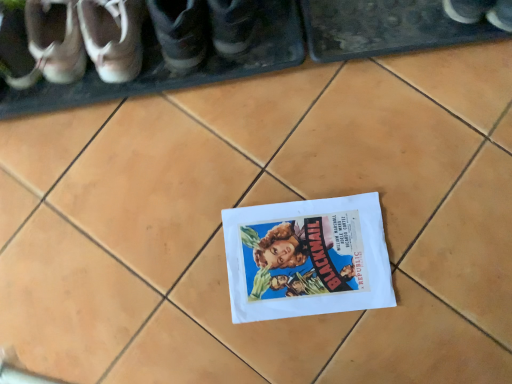
Describe the element at coordinates (307, 258) in the screenshot. The image size is (512, 384). I see `white paper flyer at center` at that location.

Measure the distance between point (108, 57) and camera.

Point (108, 57) and camera are 76.10 centimeters apart from each other.

Locate an element on the screen. The width and height of the screenshot is (512, 384). matte brown shoe at upper left, the fourth footwear from the right is located at coordinates pos(113,37).

What do you see at coordinates (15, 49) in the screenshot? I see `white leather shoe at left, marked as the sixth footwear in a right-to-left arrangement` at bounding box center [15, 49].

I want to click on dark gray leather shoe at upper left, the 5th footwear from the left, so click(180, 32).

This screenshot has width=512, height=384. What are the coordinates of `matte white sneakers at upper left, arranged as the 3th footwear when viewed from the right` in the screenshot? It's located at (230, 54).

Where is `matte leather shoes at upper left, the fifth footwear positioned from the right`? The image size is (512, 384). matte leather shoes at upper left, the fifth footwear positioned from the right is located at coordinates (55, 39).

In order to click on white paper flyer at center in this screenshot , I will do `click(307, 258)`.

Considering the relative sizes of matte black shoe at center, the 1th footwear from the right, and white leather shoe at left, marked as the sixth footwear in a right-to-left arrangement, in the image provided, is matte black shoe at center, the 1th footwear from the right, smaller than white leather shoe at left, marked as the sixth footwear in a right-to-left arrangement,?

Incorrect, matte black shoe at center, the 1th footwear from the right, is not smaller in size than white leather shoe at left, marked as the sixth footwear in a right-to-left arrangement.

Is matte black shoe at center, which is the sixth footwear in left-to-right order, to the right of white leather shoe at left, which ranks as the first footwear in left-to-right order, from the viewer's perspective?

Yes.

From a real-world perspective, between matte black shoe at center, which is the sixth footwear in left-to-right order, and white leather shoe at left, which ranks as the first footwear in left-to-right order, who is vertically lower?

white leather shoe at left, which ranks as the first footwear in left-to-right order, is physically lower.

Is white leather shoe at left, marked as the sixth footwear in a right-to-left arrangement, at the back of matte black shoe at center, which is the sixth footwear in left-to-right order?

No, white leather shoe at left, marked as the sixth footwear in a right-to-left arrangement, is not at the back of matte black shoe at center, which is the sixth footwear in left-to-right order.

Are matte white sneakers at upper left, arranged as the 3th footwear when viewed from the right, and white paper flyer at center beside each other?

matte white sneakers at upper left, arranged as the 3th footwear when viewed from the right, and white paper flyer at center are clearly separated.

From the image's perspective, which is above, matte white sneakers at upper left, which is the fourth footwear from left to right, or white paper flyer at center?

matte white sneakers at upper left, which is the fourth footwear from left to right, is shown above in the image.

Which is closer, (3, 40) or (264, 224)?

The point (3, 40) is closer.

Considering the sizes of objects matte white sneakers at upper left, which is the fourth footwear from left to right, and white paper flyer at center in the image provided, who is shorter, matte white sneakers at upper left, which is the fourth footwear from left to right, or white paper flyer at center?

With less height is white paper flyer at center.

Would you say dark gray leather shoe at upper left, the 2th footwear from the right, is outside matte leather shoes at upper left, the fifth footwear positioned from the right?

Yes, dark gray leather shoe at upper left, the 2th footwear from the right, is not within matte leather shoes at upper left, the fifth footwear positioned from the right.

How far apart are dark gray leather shoe at upper left, the 2th footwear from the right, and matte leather shoes at upper left, which ranks as the 2th footwear in left-to-right order?

The distance of dark gray leather shoe at upper left, the 2th footwear from the right, from matte leather shoes at upper left, which ranks as the 2th footwear in left-to-right order, is 19.42 centimeters.

Which is in front, point (182, 55) or point (48, 41)?

Positioned in front is point (182, 55).

Locate an element on the screen. This screenshot has height=384, width=512. the 1st footwear positioned below the dark gray leather shoe at upper left, the 5th footwear from the left (from the image's perspective) is located at coordinates (55, 39).

Who is more distant, white paper flyer at center or dark gray leather shoe at upper left, the 2th footwear from the right?

white paper flyer at center is further from the camera.

Is white paper flyer at center placed right next to dark gray leather shoe at upper left, the 5th footwear from the left?

white paper flyer at center is not next to dark gray leather shoe at upper left, the 5th footwear from the left, and they're not touching.

How much distance is there between white paper flyer at center and dark gray leather shoe at upper left, the 5th footwear from the left?

white paper flyer at center and dark gray leather shoe at upper left, the 5th footwear from the left, are 15.97 inches apart from each other.

Consider the image. From a real-world perspective, who is located lower, white leather shoe at left, which ranks as the first footwear in left-to-right order, or matte leather shoes at upper left, the fifth footwear positioned from the right?

matte leather shoes at upper left, the fifth footwear positioned from the right, from a real-world perspective.

Can you confirm if white leather shoe at left, marked as the sixth footwear in a right-to-left arrangement, is shorter than matte leather shoes at upper left, which ranks as the 2th footwear in left-to-right order?

No.

Do you think white leather shoe at left, which ranks as the first footwear in left-to-right order, is within matte leather shoes at upper left, which ranks as the 2th footwear in left-to-right order, or outside of it?

The correct answer is: outside.

From the image's perspective, does white leather shoe at left, which ranks as the first footwear in left-to-right order, appear lower than matte leather shoes at upper left, which ranks as the 2th footwear in left-to-right order?

Correct, white leather shoe at left, which ranks as the first footwear in left-to-right order, appears lower than matte leather shoes at upper left, which ranks as the 2th footwear in left-to-right order, in the image.

In the scene shown: Considering the relative positions of matte leather shoes at upper left, the fifth footwear positioned from the right, and matte white sneakers at upper left, which is the fourth footwear from left to right, in the image provided, is matte leather shoes at upper left, the fifth footwear positioned from the right, behind matte white sneakers at upper left, which is the fourth footwear from left to right,?

No, the depth of matte leather shoes at upper left, the fifth footwear positioned from the right, is less than that of matte white sneakers at upper left, which is the fourth footwear from left to right.

There is a matte leather shoes at upper left, the fifth footwear positioned from the right. Where is `the 2nd footwear below it (from a real-world perspective)`? The width and height of the screenshot is (512, 384). the 2nd footwear below it (from a real-world perspective) is located at coordinates (230, 54).

Is matte leather shoes at upper left, the fifth footwear positioned from the right, at the right side of matte white sneakers at upper left, arranged as the 3th footwear when viewed from the right?

Incorrect, matte leather shoes at upper left, the fifth footwear positioned from the right, is not on the right side of matte white sneakers at upper left, arranged as the 3th footwear when viewed from the right.

Does matte brown shoe at upper left, the fourth footwear from the right, have a larger size compared to matte black shoe at center, the 1th footwear from the right?

No, matte brown shoe at upper left, the fourth footwear from the right, is not bigger than matte black shoe at center, the 1th footwear from the right.

From a real-world perspective, is matte brown shoe at upper left, marked as the third footwear in a left-to-right arrangement, physically located above or below matte black shoe at center, the 1th footwear from the right?

From a real-world perspective, matte brown shoe at upper left, marked as the third footwear in a left-to-right arrangement, is physically below matte black shoe at center, the 1th footwear from the right.

Could matte black shoe at center, the 1th footwear from the right, be considered to be inside matte brown shoe at upper left, marked as the third footwear in a left-to-right arrangement?

No, matte black shoe at center, the 1th footwear from the right, is not surrounded by matte brown shoe at upper left, marked as the third footwear in a left-to-right arrangement.

Where is `footwear that is the 3rd one when counting upward from the matte brown shoe at upper left, the fourth footwear from the right (from the image's perspective)`? footwear that is the 3rd one when counting upward from the matte brown shoe at upper left, the fourth footwear from the right (from the image's perspective) is located at coordinates (232, 24).

Starting from the matte black shoe at center, the 1th footwear from the right, which footwear is the 2nd one behind? Please provide its 2D coordinates.

[(15, 49)]

From the image's perspective, which footwear is the 1st one above the white paper flyer at center? Please provide its 2D coordinates.

[(230, 54)]

Considering their positions, is white paper flyer at center positioned closer to matte leather shoes at upper left, which ranks as the 2th footwear in left-to-right order, than matte white sneakers at upper left, which is the fourth footwear from left to right?

matte white sneakers at upper left, which is the fourth footwear from left to right, is positioned closer to the anchor matte leather shoes at upper left, which ranks as the 2th footwear in left-to-right order.

When comparing their distances from white paper flyer at center, does matte black shoe at center, which is the sixth footwear in left-to-right order, or dark gray leather shoe at upper left, the 5th footwear from the left, seem further?

matte black shoe at center, which is the sixth footwear in left-to-right order.

When comparing their distances from matte leather shoes at upper left, the fifth footwear positioned from the right, does matte black shoe at center, which is the sixth footwear in left-to-right order, or white paper flyer at center seem closer?

matte black shoe at center, which is the sixth footwear in left-to-right order, lies closer to matte leather shoes at upper left, the fifth footwear positioned from the right, than the other object.

Looking at the image, which one is located further to matte brown shoe at upper left, marked as the third footwear in a left-to-right arrangement, matte leather shoes at upper left, which ranks as the 2th footwear in left-to-right order, or matte white sneakers at upper left, arranged as the 3th footwear when viewed from the right?

Among the two, matte white sneakers at upper left, arranged as the 3th footwear when viewed from the right, is located further to matte brown shoe at upper left, marked as the third footwear in a left-to-right arrangement.

When comparing their distances from matte white sneakers at upper left, arranged as the 3th footwear when viewed from the right, does matte leather shoes at upper left, the fifth footwear positioned from the right, or white leather shoe at left, marked as the sixth footwear in a right-to-left arrangement, seem closer?

Among the two, matte leather shoes at upper left, the fifth footwear positioned from the right, is located nearer to matte white sneakers at upper left, arranged as the 3th footwear when viewed from the right.

Which object lies nearer to the anchor point matte black shoe at center, which is the sixth footwear in left-to-right order, matte brown shoe at upper left, marked as the third footwear in a left-to-right arrangement, or white paper flyer at center?

Among the two, matte brown shoe at upper left, marked as the third footwear in a left-to-right arrangement, is located nearer to matte black shoe at center, which is the sixth footwear in left-to-right order.

Based on the photo, estimate the real-world distances between objects in this image. Which object is further from white leather shoe at left, which ranks as the first footwear in left-to-right order, dark gray leather shoe at upper left, the 2th footwear from the right, or matte black shoe at center, the 1th footwear from the right?

matte black shoe at center, the 1th footwear from the right, is positioned further to the anchor white leather shoe at left, which ranks as the first footwear in left-to-right order.

Consider the image. From the image, which object appears to be nearer to matte leather shoes at upper left, which ranks as the 2th footwear in left-to-right order, white paper flyer at center or dark gray leather shoe at upper left, the 5th footwear from the left?

dark gray leather shoe at upper left, the 5th footwear from the left, lies closer to matte leather shoes at upper left, which ranks as the 2th footwear in left-to-right order, than the other object.

Identify the location of footwear situated between matte leather shoes at upper left, which ranks as the 2th footwear in left-to-right order, and matte white sneakers at upper left, which is the fourth footwear from left to right, from left to right. (113, 37).

Find the location of a particular element. This screenshot has width=512, height=384. footwear between matte white sneakers at upper left, which is the fourth footwear from left to right, and matte black shoe at center, which is the sixth footwear in left-to-right order is located at coordinates (180, 32).

The width and height of the screenshot is (512, 384). Identify the location of footwear between white leather shoe at left, which ranks as the first footwear in left-to-right order, and matte brown shoe at upper left, the fourth footwear from the right, from left to right. (55, 39).